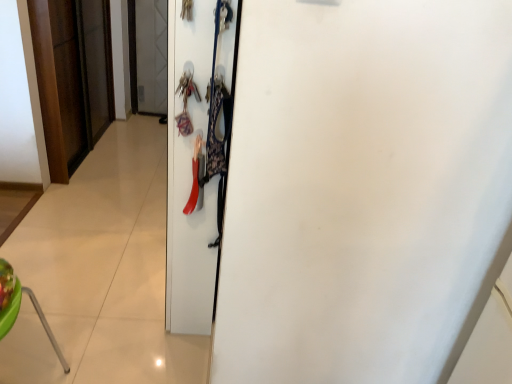
I want to click on vacant space situated on the left part of white matte door at center, the 1th door viewed from the front, so click(119, 283).